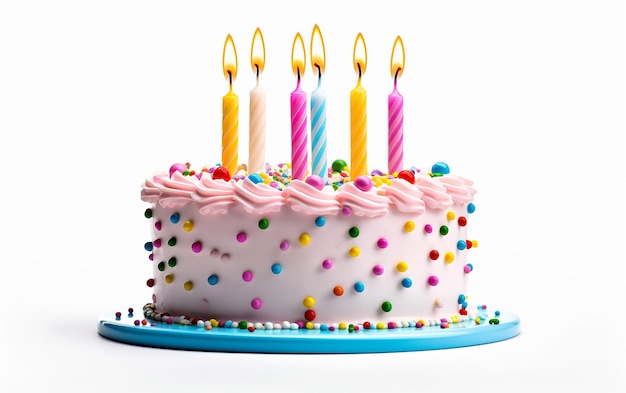
Where is `number of candle wicks`? number of candle wicks is located at coordinates tap(397, 77), tap(360, 72), tap(319, 74), tap(299, 74), tap(260, 75), tap(233, 79).